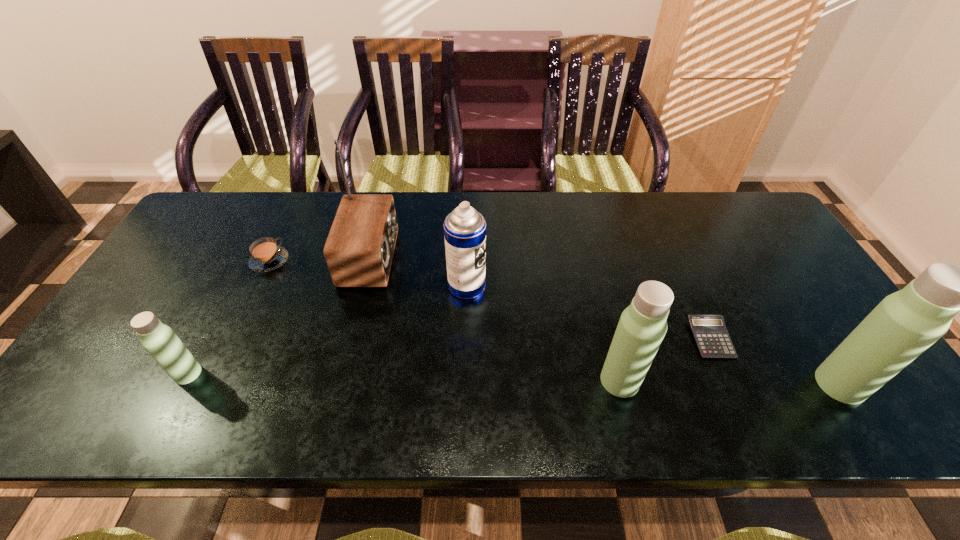
Locate an element on the screen. The height and width of the screenshot is (540, 960). blank area located on the back of the leftmost thermos bottle is located at coordinates (211, 329).

Identify the location of free space located on the back of the second thermos bottle from right to left. The width and height of the screenshot is (960, 540). (589, 259).

What are the coordinates of `vacant position located on the back of the rightmost thermos bottle` in the screenshot? It's located at (810, 337).

The image size is (960, 540). I want to click on free space located on the front-facing side of the third object from left to right, so click(x=514, y=258).

Where is `vacant space located on the right of the second shortest object`? The width and height of the screenshot is (960, 540). vacant space located on the right of the second shortest object is located at coordinates (313, 261).

Where is `vacant space positioned 0.220m on the label side of the aerosol can`? vacant space positioned 0.220m on the label side of the aerosol can is located at coordinates (565, 286).

Find the location of `free space located 0.400m on the left of the calculator`. free space located 0.400m on the left of the calculator is located at coordinates (532, 339).

Locate an element on the screen. Image resolution: width=960 pixels, height=540 pixels. object that is at the far edge is located at coordinates (359, 249).

Where is `calculator at the near edge`? calculator at the near edge is located at coordinates (710, 333).

The width and height of the screenshot is (960, 540). I want to click on object that is positioned at the right edge, so click(904, 324).